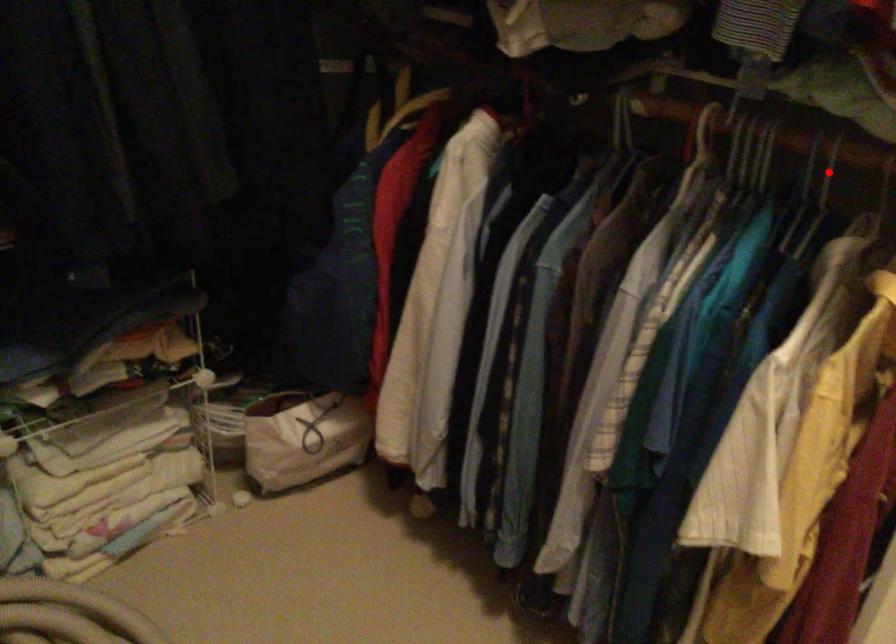
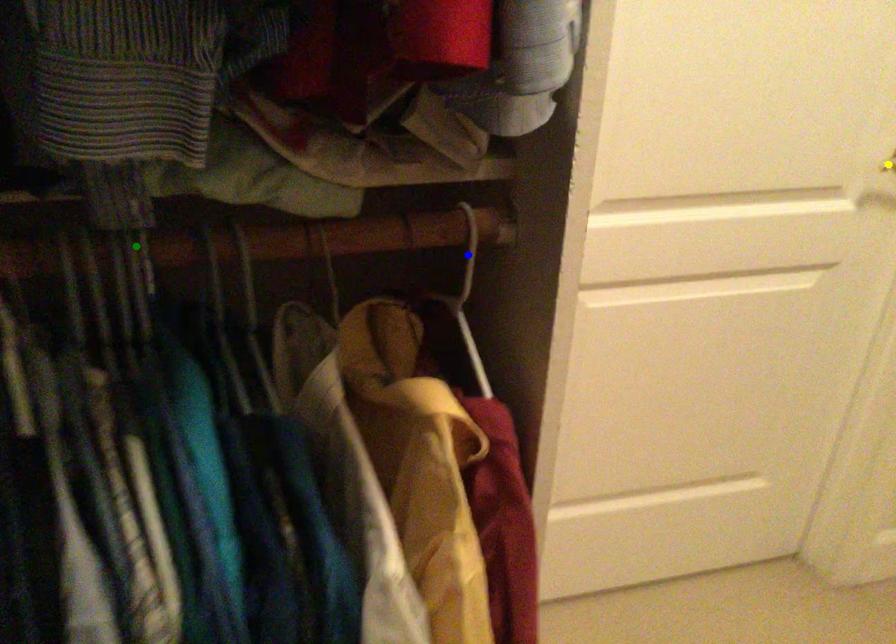
Question: I am providing you with two images of the same scene from different viewpoints. A red point is marked on the first image. You are given multiple points on the second image. Which mark in image 2 goes with the point in image 1?

Choices:
 (A) yellow point
 (B) green point
 (C) blue point

Answer: (B)